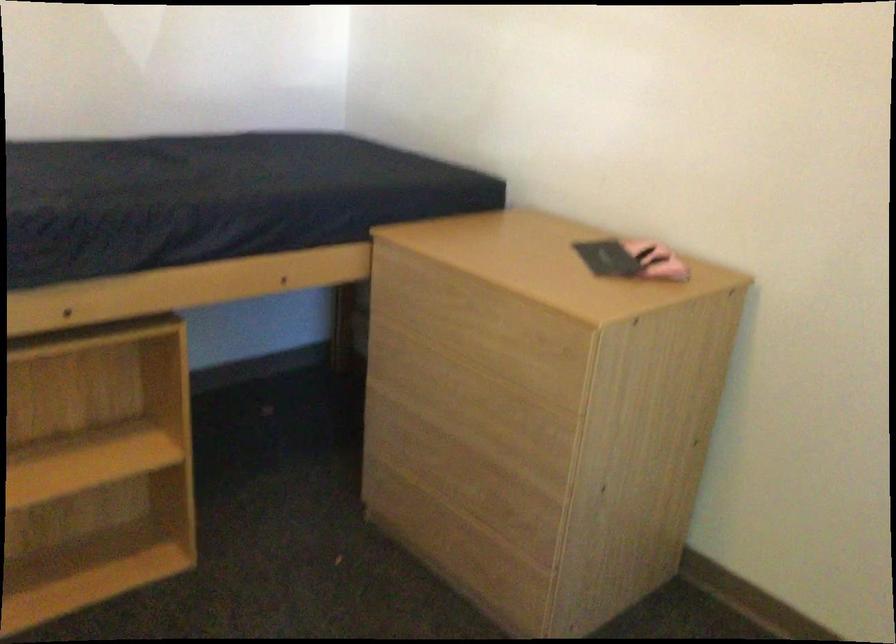
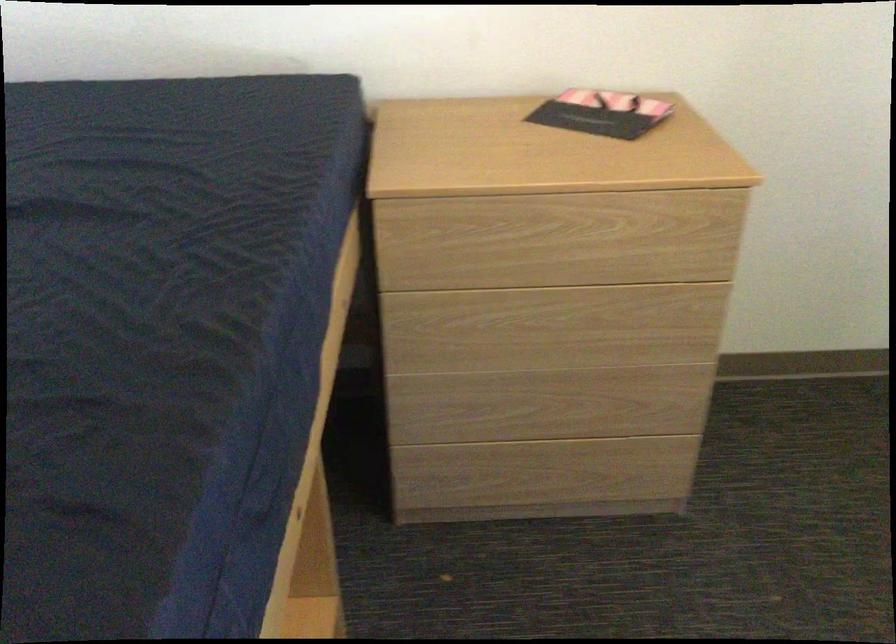
The point at (460, 317) is marked in the first image. Where is the corresponding point in the second image?

(557, 240)